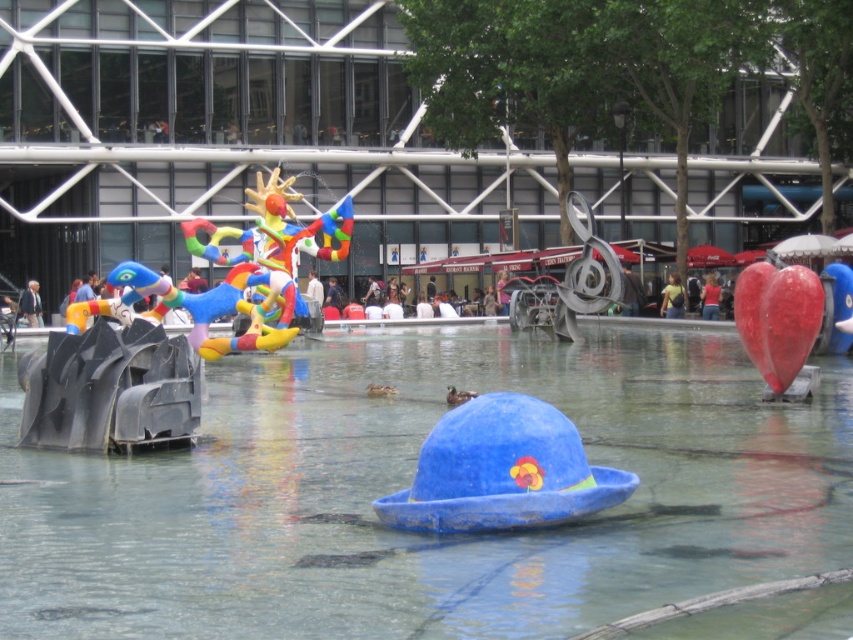
Who is shorter, blue felt hat at center or rubber heart at right?

blue felt hat at center

Who is higher up, blue felt hat at center or rubber heart at right?

Positioned higher is rubber heart at right.

Which is behind, point (572, 440) or point (840, 292)?

The point (840, 292) is more distant.

At what (x,y) coordinates should I click in order to perform the action: click on blue felt hat at center. Please return your answer as a coordinate pair (x, y). The width and height of the screenshot is (853, 640). Looking at the image, I should click on (502, 472).

Who is shorter, transparent plastic water at center or rubber heart at right?

transparent plastic water at center

Describe the element at coordinates (407, 484) in the screenshot. I see `transparent plastic water at center` at that location.

Where is `transparent plastic water at center`? This screenshot has height=640, width=853. transparent plastic water at center is located at coordinates (407, 484).

Does transparent plastic water at center appear on the right side of blue felt hat at center?

Incorrect, transparent plastic water at center is not on the right side of blue felt hat at center.

From the picture: Can you confirm if transparent plastic water at center is positioned below blue felt hat at center?

Indeed, transparent plastic water at center is positioned under blue felt hat at center.

At what (x,y) coordinates should I click in order to perform the action: click on transparent plastic water at center. Please return your answer as a coordinate pair (x, y). Looking at the image, I should click on (407, 484).

Locate an element on the screen. The width and height of the screenshot is (853, 640). transparent plastic water at center is located at coordinates (407, 484).